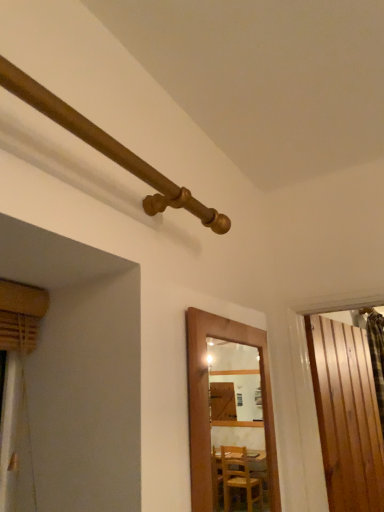
Question: Is wooden slats at right, positioned as the first door in right-to-left order, inside wooden door at center, which appears as the 2th door when viewed from the back?

Choices:
 (A) no
 (B) yes

Answer: (A)

Question: Is wooden door at center, marked as the first door in a front-to-back arrangement, positioned far away from wooden slats at right, the 2th door when ordered from left to right?

Choices:
 (A) no
 (B) yes

Answer: (A)

Question: Is wooden door at center, positioned as the second door in right-to-left order, oriented away from wooden slats at right, the second door viewed from the front?

Choices:
 (A) yes
 (B) no

Answer: (B)

Question: Can you confirm if wooden door at center, which is counted as the first door, starting from the left, is shorter than wooden slats at right, the 2th door when ordered from left to right?

Choices:
 (A) no
 (B) yes

Answer: (B)

Question: Considering the relative sizes of wooden door at center, marked as the first door in a front-to-back arrangement, and wooden slats at right, the second door viewed from the front, in the image provided, is wooden door at center, marked as the first door in a front-to-back arrangement, smaller than wooden slats at right, the second door viewed from the front,?

Choices:
 (A) yes
 (B) no

Answer: (A)

Question: Is wooden door at center, marked as the first door in a front-to-back arrangement, further to camera compared to wooden slats at right, placed as the 1th door when sorted from back to front?

Choices:
 (A) yes
 (B) no

Answer: (B)

Question: From the image's perspective, would you say wooden pipe at upper left is positioned over wooden door at center, which is counted as the first door, starting from the left?

Choices:
 (A) no
 (B) yes

Answer: (B)

Question: Would you say wooden pipe at upper left contains wooden door at center, positioned as the second door in right-to-left order?

Choices:
 (A) yes
 (B) no

Answer: (B)

Question: Considering the relative sizes of wooden pipe at upper left and wooden door at center, which is counted as the first door, starting from the left, in the image provided, is wooden pipe at upper left bigger than wooden door at center, which is counted as the first door, starting from the left,?

Choices:
 (A) yes
 (B) no

Answer: (B)

Question: Would you say wooden pipe at upper left is a long distance from wooden door at center, which is counted as the first door, starting from the left?

Choices:
 (A) no
 (B) yes

Answer: (A)

Question: From a real-world perspective, is wooden pipe at upper left beneath wooden door at center, positioned as the second door in right-to-left order?

Choices:
 (A) no
 (B) yes

Answer: (A)

Question: Is wooden pipe at upper left further to the viewer compared to wooden door at center, which appears as the 2th door when viewed from the back?

Choices:
 (A) no
 (B) yes

Answer: (A)

Question: From a real-world perspective, is wooden door at center, marked as the first door in a front-to-back arrangement, physically above wooden pipe at upper left?

Choices:
 (A) no
 (B) yes

Answer: (A)